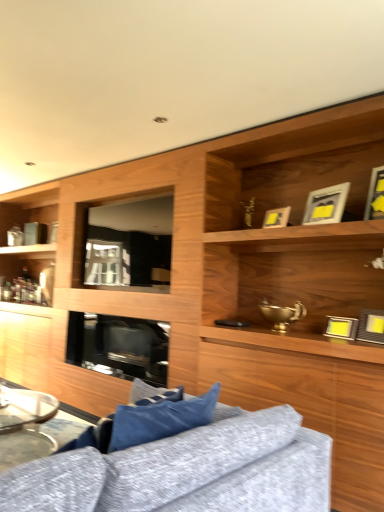
Question: From the image's perspective, would you say matte gold picture frame at upper right, which is counted as the 2th picture frame, starting from the top, is shown under transparent glass window at center?

Choices:
 (A) no
 (B) yes

Answer: (A)

Question: Can transparent glass window at center be found inside matte gold picture frame at upper right, which is counted as the fourth picture frame, starting from the bottom?

Choices:
 (A) no
 (B) yes

Answer: (A)

Question: Is matte gold picture frame at upper right, which is counted as the fourth picture frame, starting from the bottom, located outside transparent glass window at center?

Choices:
 (A) yes
 (B) no

Answer: (A)

Question: Is matte gold picture frame at upper right, which is counted as the fourth picture frame, starting from the bottom, closer to camera compared to transparent glass window at center?

Choices:
 (A) no
 (B) yes

Answer: (B)

Question: From the image's perspective, is matte gold picture frame at upper right, which is counted as the fourth picture frame, starting from the bottom, on top of transparent glass window at center?

Choices:
 (A) no
 (B) yes

Answer: (B)

Question: Considering the positions of matte gold picture frame at upper right, which is counted as the 2th picture frame, starting from the top, and textured gray fabric couch at lower center in the image, is matte gold picture frame at upper right, which is counted as the 2th picture frame, starting from the top, taller or shorter than textured gray fabric couch at lower center?

Choices:
 (A) short
 (B) tall

Answer: (A)

Question: Is matte gold picture frame at upper right, which is counted as the fourth picture frame, starting from the bottom, wider or thinner than textured gray fabric couch at lower center?

Choices:
 (A) thin
 (B) wide

Answer: (A)

Question: Considering the positions of matte gold picture frame at upper right, which is counted as the 2th picture frame, starting from the top, and textured gray fabric couch at lower center in the image, is matte gold picture frame at upper right, which is counted as the 2th picture frame, starting from the top, bigger or smaller than textured gray fabric couch at lower center?

Choices:
 (A) small
 (B) big

Answer: (A)

Question: From a real-world perspective, is matte gold picture frame at upper right, which is counted as the 2th picture frame, starting from the top, physically located above or below textured gray fabric couch at lower center?

Choices:
 (A) below
 (B) above

Answer: (B)

Question: From the image's perspective, is black glass fireplace at center positioned above or below matte gold picture frame at upper right, which is counted as the 2th picture frame, starting from the top?

Choices:
 (A) above
 (B) below

Answer: (B)

Question: Considering the positions of point (147, 353) and point (334, 205), is point (147, 353) closer or farther from the camera than point (334, 205)?

Choices:
 (A) closer
 (B) farther

Answer: (B)

Question: In terms of height, does black glass fireplace at center look taller or shorter compared to matte gold picture frame at upper right, which is counted as the fourth picture frame, starting from the bottom?

Choices:
 (A) short
 (B) tall

Answer: (B)

Question: Is black glass fireplace at center wider or thinner than matte gold picture frame at upper right, which is counted as the fourth picture frame, starting from the bottom?

Choices:
 (A) thin
 (B) wide

Answer: (B)

Question: From the image's perspective, is yellow matte picture frame at right, the 2th picture frame from the bottom, located above or below textured gray fabric couch at lower center?

Choices:
 (A) above
 (B) below

Answer: (A)

Question: Is point (x=365, y=335) closer or farther from the camera than point (x=117, y=494)?

Choices:
 (A) closer
 (B) farther

Answer: (B)